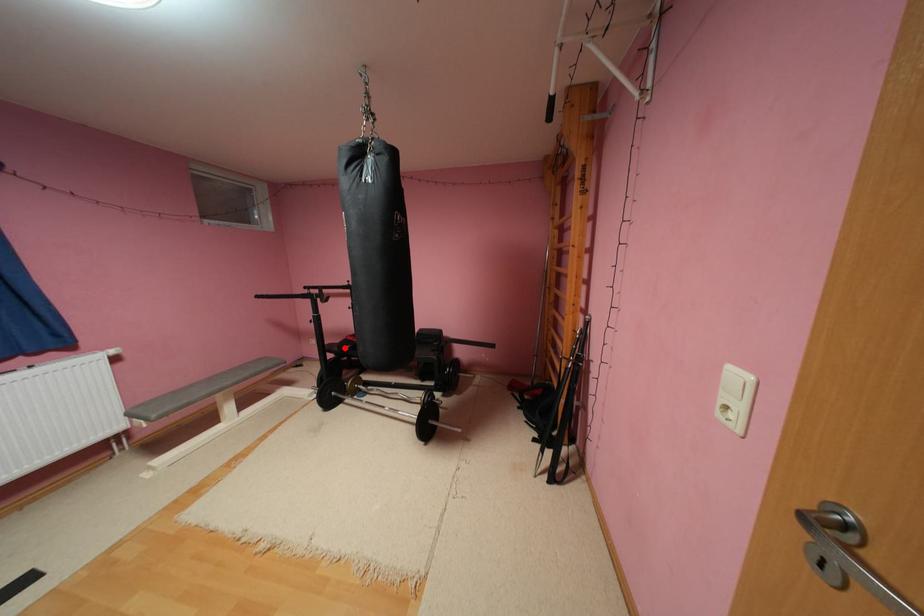
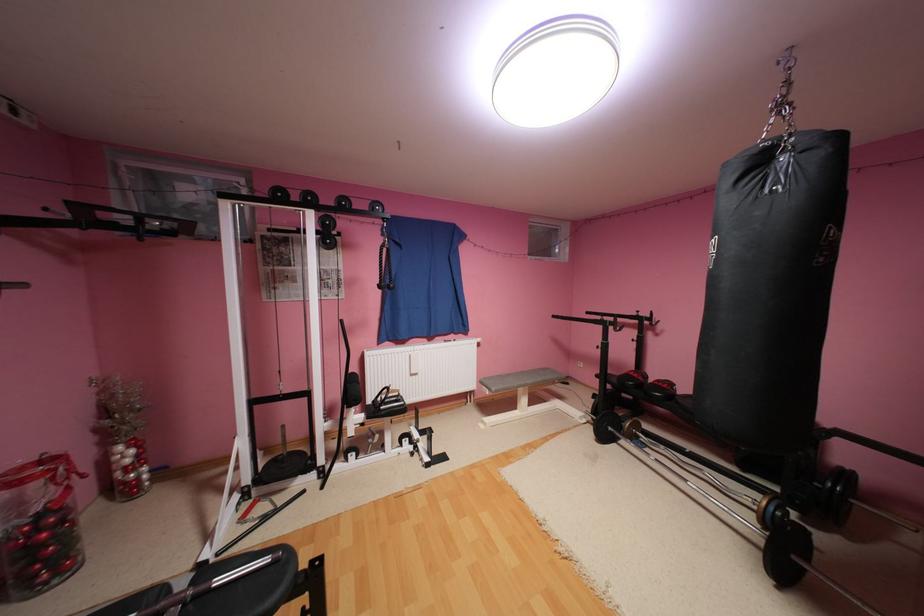
The point at the highlighted location is marked in the first image. Where is the corresponding point in the second image?

(624, 379)